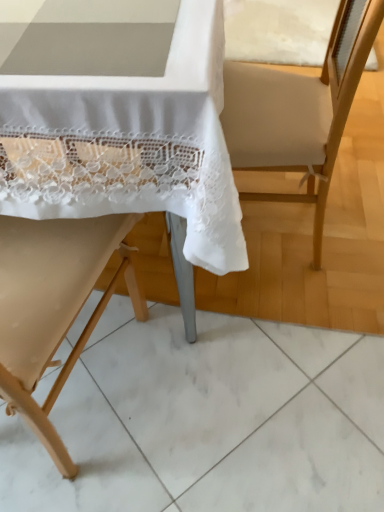
Question: Considering the positions of point (362, 22) and point (28, 386), is point (362, 22) closer or farther from the camera than point (28, 386)?

Choices:
 (A) closer
 (B) farther

Answer: (B)

Question: In terms of width, does beige fabric armchair at center look wider or thinner when compared to beige fabric chair at left, the second chair in the top-to-bottom sequence?

Choices:
 (A) thin
 (B) wide

Answer: (A)

Question: Which of these objects is positioned farthest from the beige fabric armchair at center?

Choices:
 (A) beige wood chair at center, positioned as the second chair in bottom-to-top order
 (B) beige fabric chair at left, which is counted as the 1th chair, starting from the bottom

Answer: (B)

Question: Which is farther from the beige wood chair at center, which appears as the 1th chair when viewed from the top?

Choices:
 (A) beige fabric armchair at center
 (B) beige fabric chair at left, which is counted as the 1th chair, starting from the bottom

Answer: (A)